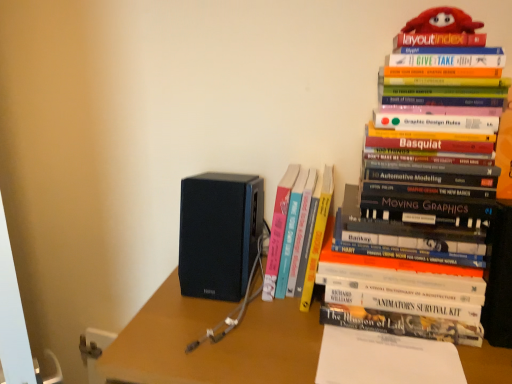
Where is `unoccupied area in front of black matte speaker at center`? unoccupied area in front of black matte speaker at center is located at coordinates (214, 324).